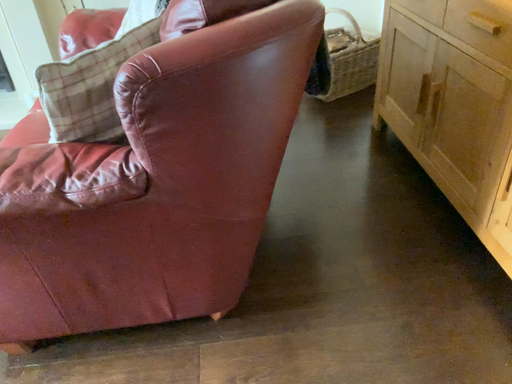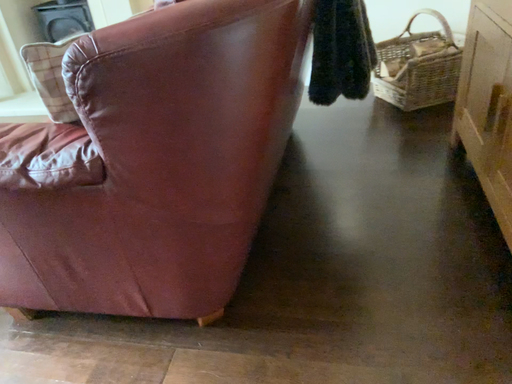
Question: How did the camera likely rotate when shooting the video?

Choices:
 (A) rotated right
 (B) rotated left

Answer: (B)